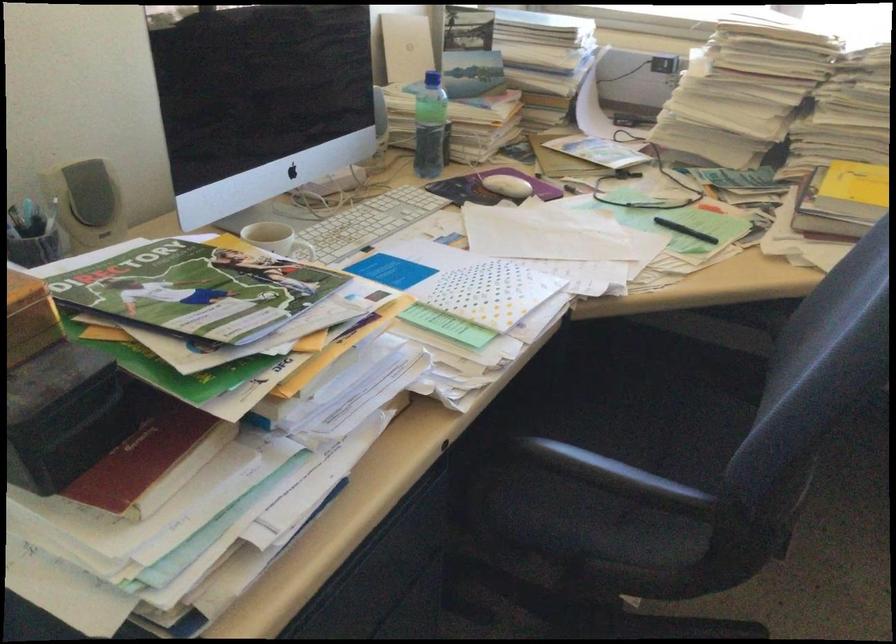
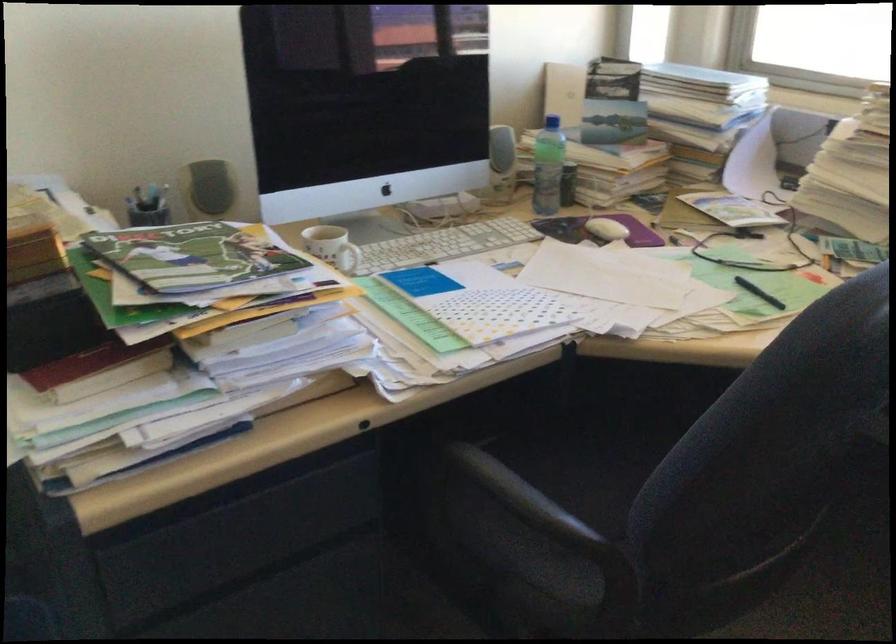
Find the pixel in the second image that matches point 686,230 in the first image.

(759, 292)